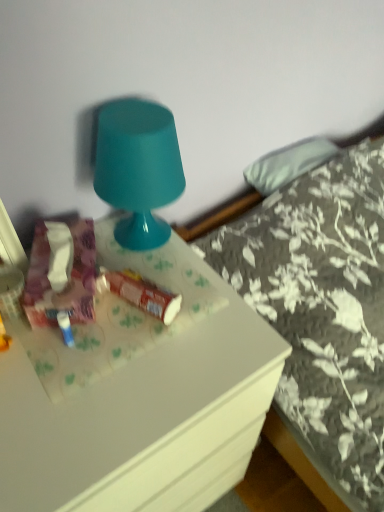
Locate an element on the screen. Image resolution: width=384 pixels, height=512 pixels. vacant space to the right of matte floral tissue box at left, which appears as the 1th stuff when viewed from the left is located at coordinates (167, 290).